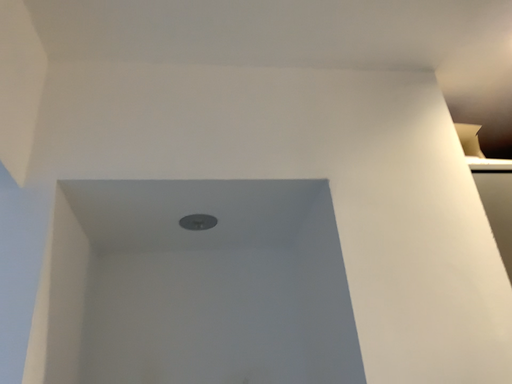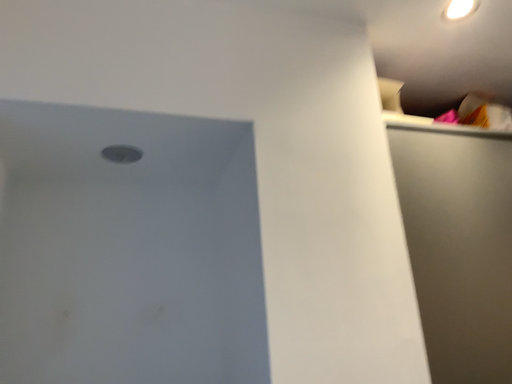
Question: Which way did the camera rotate in the video?

Choices:
 (A) rotated right
 (B) rotated left

Answer: (A)